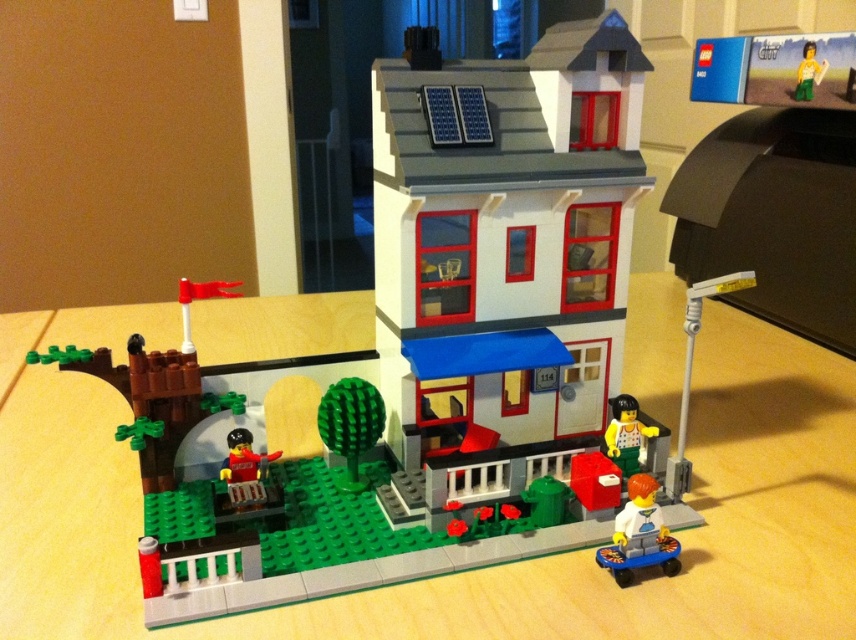
Is white matte minifigure at lower right behind yellow matte figure at center?

No, white matte minifigure at lower right is closer to the viewer.

Does white matte minifigure at lower right appear under yellow matte figure at center?

Correct, white matte minifigure at lower right is located below yellow matte figure at center.

This screenshot has height=640, width=856. In order to click on white matte minifigure at lower right in this screenshot , I will do (x=639, y=534).

You are a GUI agent. You are given a task and a screenshot of the screen. Output one action in this format:
    pyautogui.click(x=<x>, y=<y>)
    Task: Click on the white matte minifigure at lower right
    The image size is (856, 640).
    Given the screenshot: What is the action you would take?
    pyautogui.click(x=639, y=534)

The image size is (856, 640). I want to click on wooden table at center, so click(x=483, y=568).

Which is behind, point (563, 608) or point (652, 433)?

The point (652, 433) is behind.

Identify the location of wooden table at center. The width and height of the screenshot is (856, 640). (483, 568).

Who is lower down, matte red minifigure at lower left or yellow matte figure at center?

matte red minifigure at lower left is lower down.

Identify the location of matte red minifigure at lower left. The image size is (856, 640). (245, 468).

Where is `matte red minifigure at lower left`? The image size is (856, 640). matte red minifigure at lower left is located at coordinates (245, 468).